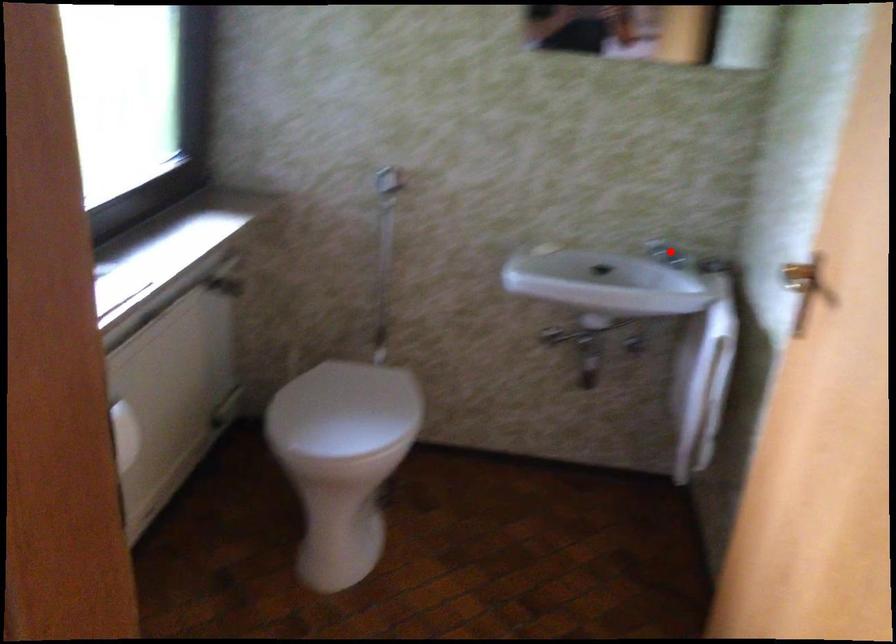
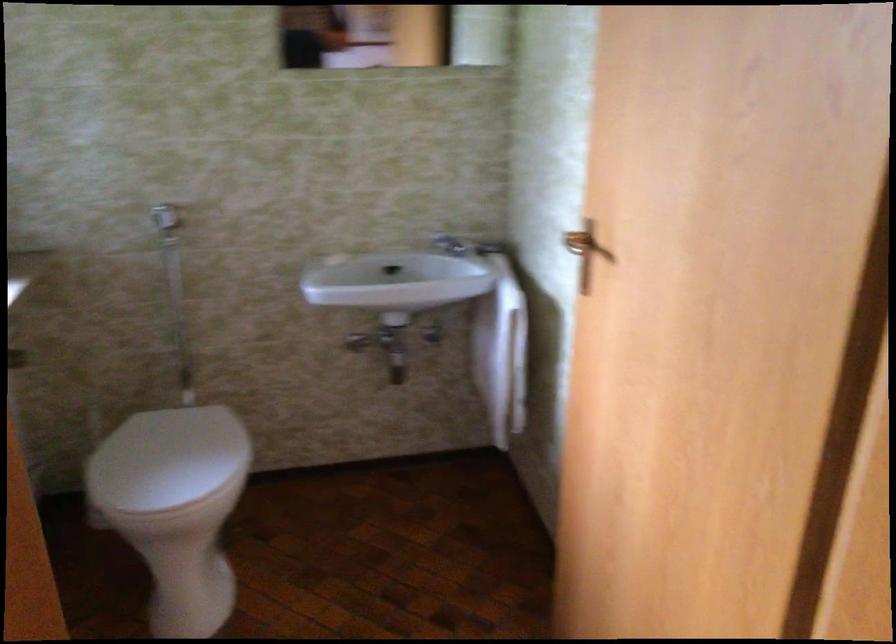
The point at the highlighted location is marked in the first image. Where is the corresponding point in the second image?

(450, 245)